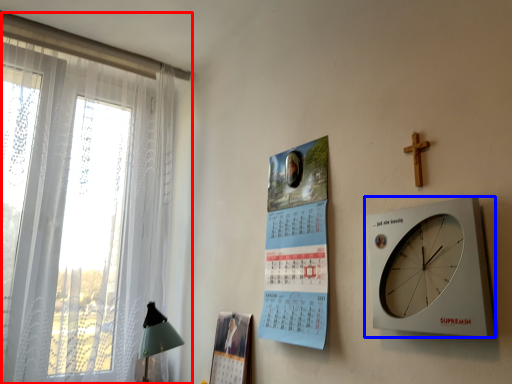
Question: Which object is further to the camera taking this photo, window (highlighted by a red box) or wall clock (highlighted by a blue box)?

Choices:
 (A) window
 (B) wall clock

Answer: (A)